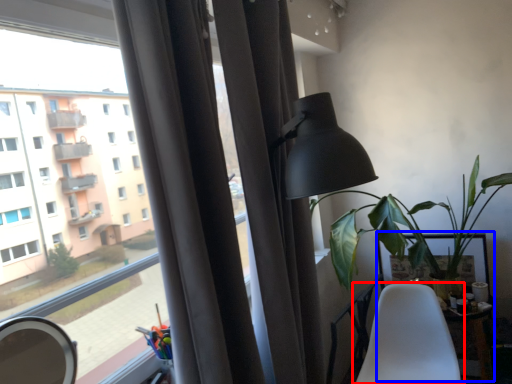
Question: Which of the following is the closest to the observer, chair (highlighted by a red box) or table (highlighted by a blue box)?

Choices:
 (A) chair
 (B) table

Answer: (A)